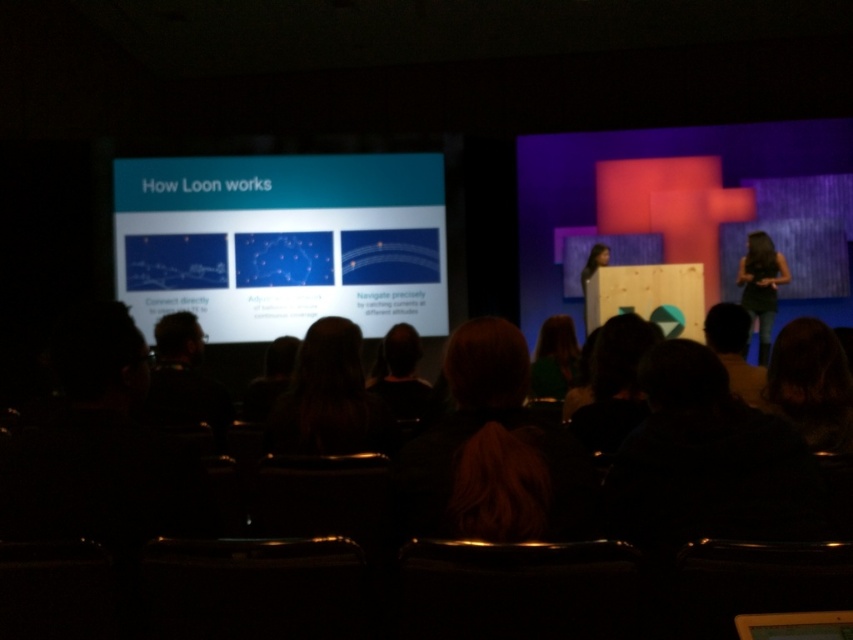
You are an attendee sitting in the back row of the conference room. You want to take a photo of the slide on the white glossy projector screen at upper left with your phone. However, there is a person wearing a matte black dress at center blocking your view. Can you see the slide clearly through the person?

The white glossy projector screen at upper left is taller than the matte black dress at center, so you can see the slide above the person wearing the matte black dress at center.